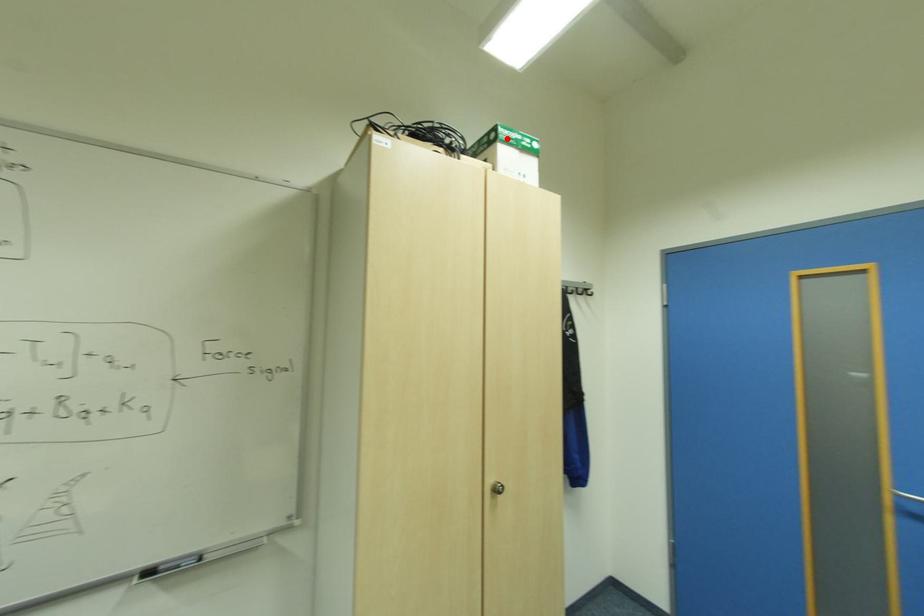
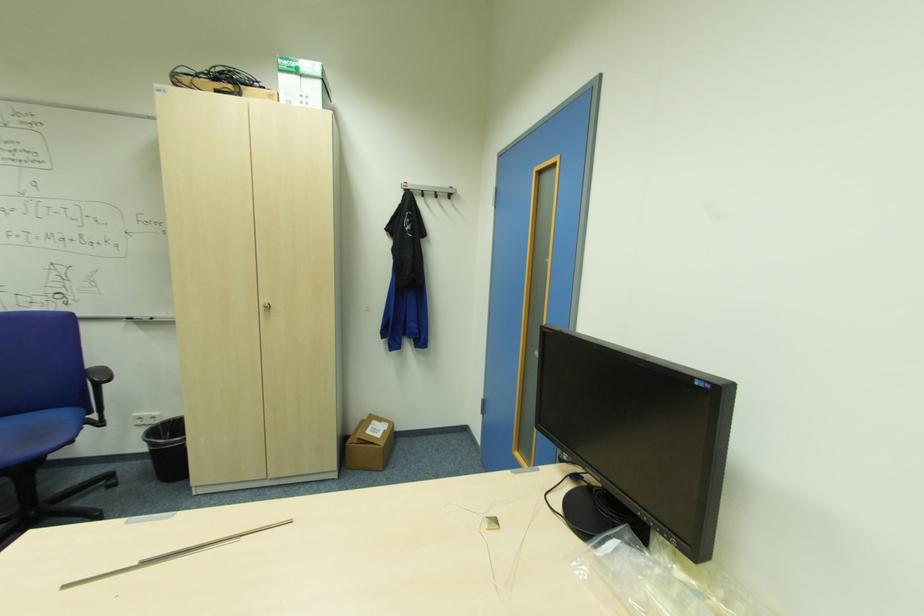
The point at the highlighted location is marked in the first image. Where is the corresponding point in the second image?

(287, 69)